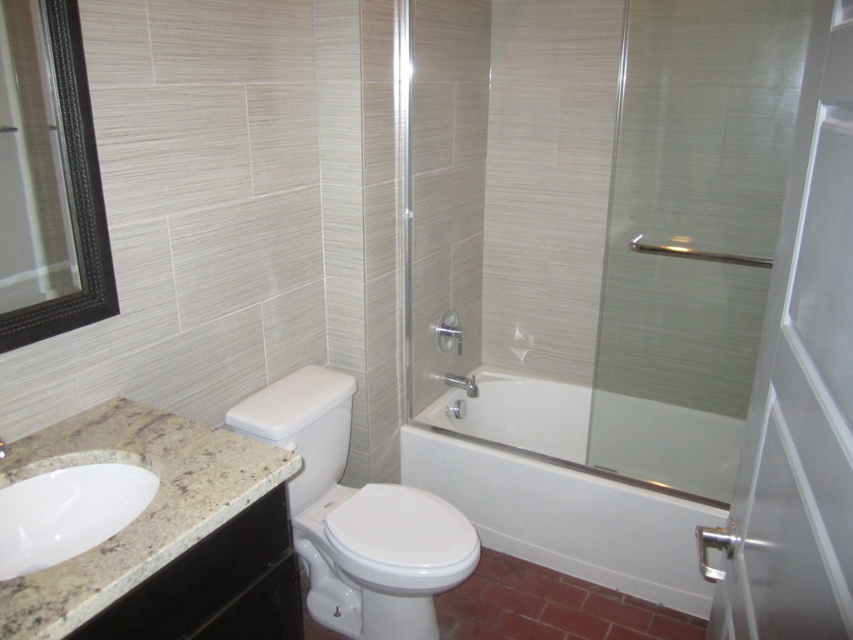
Question: Estimate the real-world distances between objects in this image. Which object is closer to the clear glass screen door at right?

Choices:
 (A) clear glass shower door at right
 (B) matte silver faucet at upper center
 (C) white glossy bathtub at center
 (D) white glossy toilet at center

Answer: (D)

Question: Considering the relative positions of white glossy toilet at center and matte silver faucet at upper center in the image provided, where is white glossy toilet at center located with respect to matte silver faucet at upper center?

Choices:
 (A) below
 (B) above

Answer: (A)

Question: Which point is closer to the camera?

Choices:
 (A) (456, 330)
 (B) (289, 484)
 (C) (671, 173)
 (D) (68, 524)

Answer: (D)

Question: Among these points, which one is farthest from the camera?

Choices:
 (A) 345,513
 (B) 134,483
 (C) 454,332
 (D) 456,387

Answer: (D)

Question: Does clear glass shower door at right appear under white marble sink at lower left?

Choices:
 (A) yes
 (B) no

Answer: (B)

Question: Is white marble sink at lower left to the right of matte silver faucet at upper center from the viewer's perspective?

Choices:
 (A) no
 (B) yes

Answer: (A)